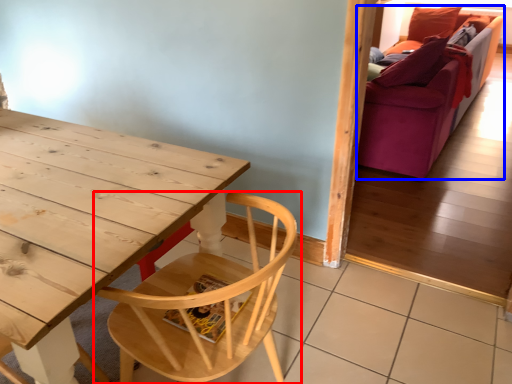
Question: Which object appears closest to the camera in this image, chair (highlighted by a red box) or studio couch (highlighted by a blue box)?

Choices:
 (A) chair
 (B) studio couch

Answer: (A)